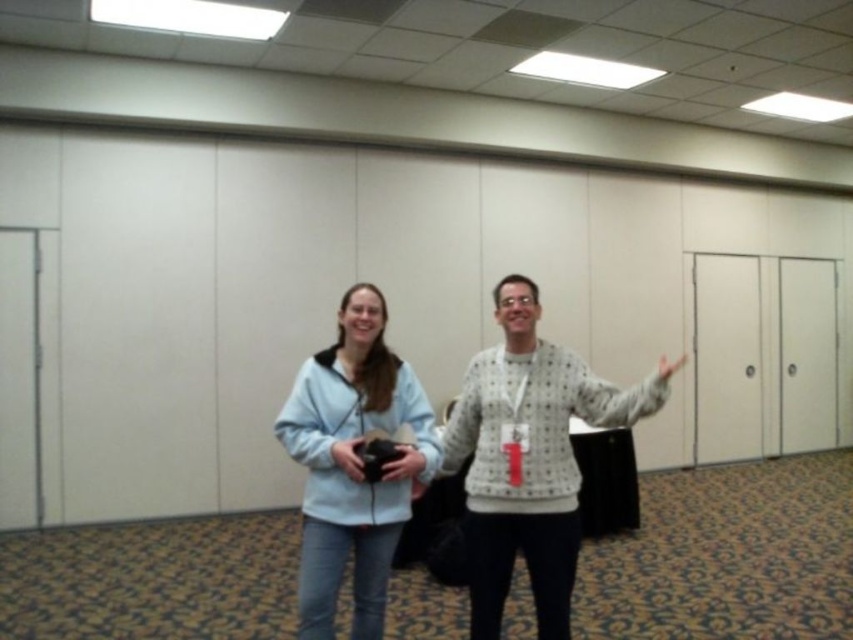
Question: From the image, what is the correct spatial relationship of light blue fleece at center in relation to matte gray hand at right?

Choices:
 (A) below
 (B) above

Answer: (A)

Question: Which point appears closest to the camera in this image?

Choices:
 (A) (560, 355)
 (B) (341, 458)

Answer: (B)

Question: Observing the image, what is the correct spatial positioning of matte gray sweater at center in reference to matte gray hand at right?

Choices:
 (A) right
 (B) left

Answer: (B)

Question: Is matte gray sweater at center positioned before matte gray hand at right?

Choices:
 (A) no
 (B) yes

Answer: (B)

Question: Which point is farther from the camera taking this photo?

Choices:
 (A) (392, 468)
 (B) (660, 362)
 (C) (486, 356)
 (D) (339, 461)

Answer: (B)

Question: Which of the following is the farthest from the observer?

Choices:
 (A) matte gray sweater at center
 (B) matte gray hand at right
 (C) matte black camera at center
 (D) light blue fleece at center

Answer: (B)